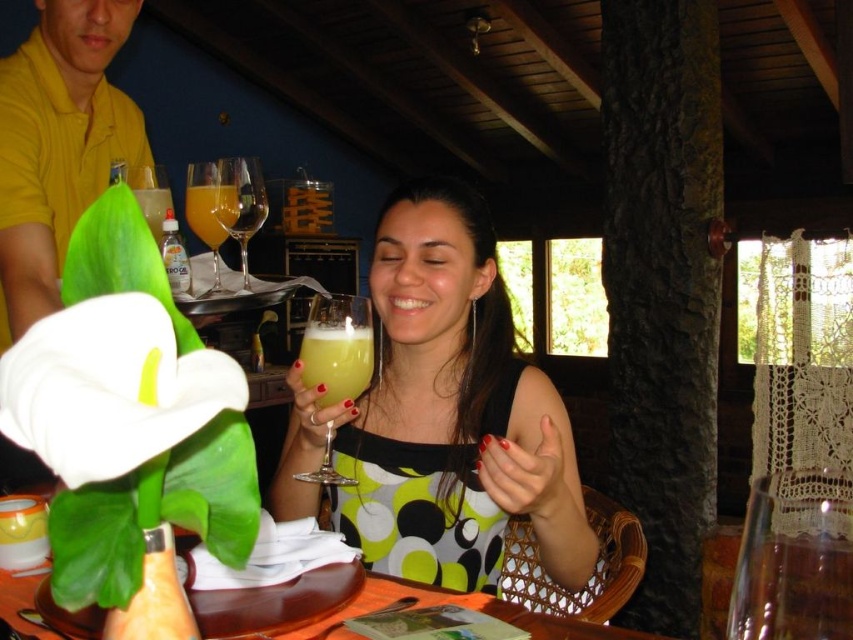
Question: Does translucent glass at upper center lie behind translucent glass at upper left?

Choices:
 (A) yes
 (B) no

Answer: (A)

Question: Which object is positioned farthest from the translucent glass at upper left?

Choices:
 (A) yellow cotton shirt at upper left
 (B) translucent yellow liquid at center
 (C) translucent glass wine glass at upper center
 (D) orange wood table at lower center

Answer: (D)

Question: Estimate the real-world distances between objects in this image. Which object is closer to the yellow cotton shirt at upper left?

Choices:
 (A) translucent glass wine glass at center
 (B) translucent glass at upper center
 (C) translucent glass at upper left
 (D) translucent glass at center

Answer: (C)

Question: Which point is farther to the camera?

Choices:
 (A) translucent glass at upper center
 (B) translucent glass wine glass at upper center
 (C) green dotted dress at center

Answer: (B)

Question: Can you confirm if green dotted dress at center is positioned to the left of transparent glass wine glass at upper center?

Choices:
 (A) yes
 (B) no

Answer: (B)

Question: Does yellow cotton shirt at upper left appear on the left side of transparent glass wine glass at upper center?

Choices:
 (A) no
 (B) yes

Answer: (B)